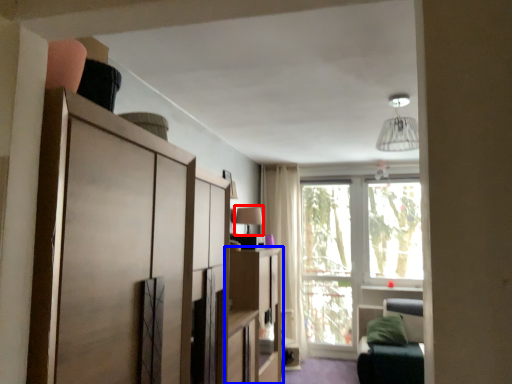
Question: Among these objects, which one is farthest to the camera, lamp (highlighted by a red box) or cabinetry (highlighted by a blue box)?

Choices:
 (A) lamp
 (B) cabinetry

Answer: (A)